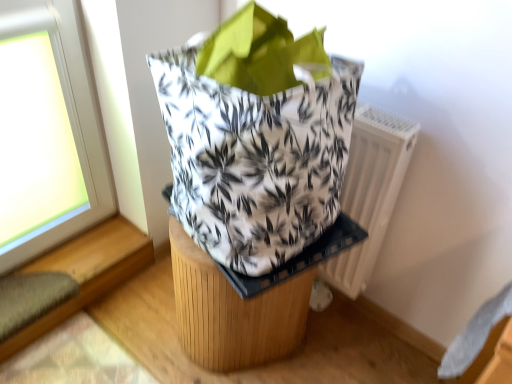
Question: Can you confirm if wooden stool at center is wider than white printed fabric grocery bag at center?

Choices:
 (A) no
 (B) yes

Answer: (A)

Question: Does wooden stool at center appear on the right side of white printed fabric grocery bag at center?

Choices:
 (A) yes
 (B) no

Answer: (B)

Question: Considering the relative sizes of wooden stool at center and white printed fabric grocery bag at center in the image provided, is wooden stool at center bigger than white printed fabric grocery bag at center?

Choices:
 (A) yes
 (B) no

Answer: (B)

Question: From a real-world perspective, is wooden stool at center located higher than white printed fabric grocery bag at center?

Choices:
 (A) yes
 (B) no

Answer: (B)

Question: From the image's perspective, is wooden stool at center below white printed fabric grocery bag at center?

Choices:
 (A) yes
 (B) no

Answer: (A)

Question: Can you confirm if wooden stool at center is positioned to the left of white printed fabric grocery bag at center?

Choices:
 (A) no
 (B) yes

Answer: (B)

Question: Is white plastic radiator at right positioned beyond the bounds of wooden stool at center?

Choices:
 (A) no
 (B) yes

Answer: (B)

Question: Is the position of white plastic radiator at right less distant than that of wooden stool at center?

Choices:
 (A) no
 (B) yes

Answer: (A)

Question: Is white plastic radiator at right to the left of wooden stool at center from the viewer's perspective?

Choices:
 (A) no
 (B) yes

Answer: (A)

Question: Is white plastic radiator at right wider than wooden stool at center?

Choices:
 (A) yes
 (B) no

Answer: (B)

Question: Is wooden stool at center inside white plastic radiator at right?

Choices:
 (A) yes
 (B) no

Answer: (B)

Question: Does white plastic radiator at right appear on the right side of wooden stool at center?

Choices:
 (A) yes
 (B) no

Answer: (A)

Question: Is white printed fabric grocery bag at center to the right of white plastic radiator at right from the viewer's perspective?

Choices:
 (A) yes
 (B) no

Answer: (B)